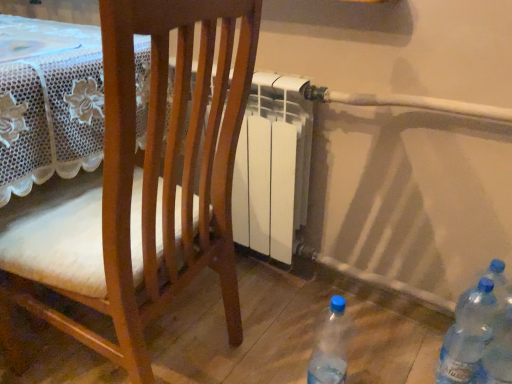
Question: From a real-world perspective, relative to wooden chair at center, is blue translucent bottle at lower right, acting as the third bottle starting from the left, vertically above or below?

Choices:
 (A) above
 (B) below

Answer: (B)

Question: Is point (509, 367) closer or farther from the camera than point (242, 107)?

Choices:
 (A) farther
 (B) closer

Answer: (A)

Question: Which object is the farthest from the transparent plastic bottles at lower right, placed as the 2th bottle when sorted from right to left?

Choices:
 (A) wooden chair at center
 (B) blue translucent bottle at lower right, acting as the third bottle starting from the left
 (C) transparent plastic bottle at lower right, which appears as the 3th bottle when viewed from the right

Answer: (A)

Question: Which object is positioned farthest from the wooden chair at center?

Choices:
 (A) blue translucent bottle at lower right, acting as the third bottle starting from the left
 (B) transparent plastic bottles at lower right, placed as the 2th bottle when sorted from right to left
 (C) transparent plastic bottle at lower right, marked as the first bottle in a left-to-right arrangement

Answer: (A)